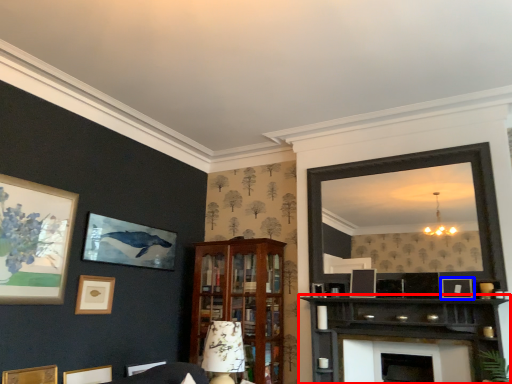
Question: Which object appears closest to the camera in this image, shelf (highlighted by a red box) or picture frame (highlighted by a blue box)?

Choices:
 (A) shelf
 (B) picture frame

Answer: (A)